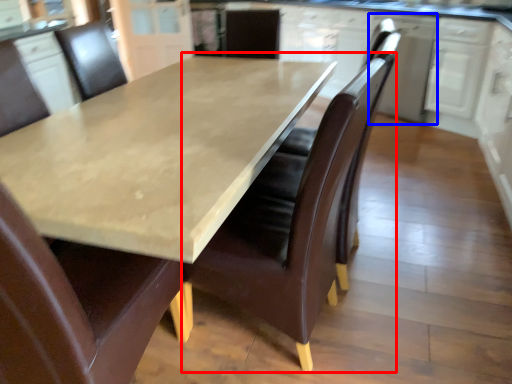
Question: Which object appears farthest to the camera in this image, chair (highlighted by a red box) or cabinetry (highlighted by a blue box)?

Choices:
 (A) chair
 (B) cabinetry

Answer: (B)